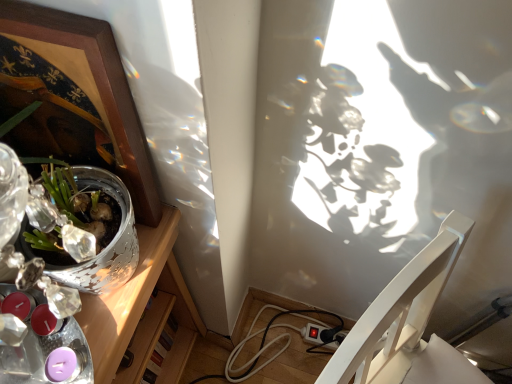
Describe the element at coordinates (137, 297) in the screenshot. Image resolution: width=512 pixels, height=384 pixels. I see `silver metallic pot at left` at that location.

In order to click on white glossy chair at lower right in this screenshot , I will do `click(408, 324)`.

Would you say wooden picture frame at upper left is a long distance from silver metallic pot at left?

wooden picture frame at upper left is actually quite close to silver metallic pot at left.

From the image's perspective, is wooden picture frame at upper left on silver metallic pot at left?

Yes, from the image's perspective, wooden picture frame at upper left is above silver metallic pot at left.

In terms of width, does wooden picture frame at upper left look wider or thinner when compared to silver metallic pot at left?

Considering their sizes, wooden picture frame at upper left looks slimmer than silver metallic pot at left.

From the image's perspective, is silver metallic pot at left located above or below wooden picture frame at upper left?

Based on their image positions, silver metallic pot at left is located beneath wooden picture frame at upper left.

From a real-world perspective, who is located lower, silver metallic pot at left or wooden picture frame at upper left?

silver metallic pot at left is physically lower.

Which is more to the left, silver metallic pot at left or wooden picture frame at upper left?

silver metallic pot at left is more to the left.

Which is in front, point (150, 258) or point (139, 125)?

The point (139, 125) is closer.

Considering the relative sizes of silver metallic pot at left and white glossy chair at lower right in the image provided, is silver metallic pot at left shorter than white glossy chair at lower right?

Correct, silver metallic pot at left is not as tall as white glossy chair at lower right.

Can you tell me how much silver metallic pot at left and white glossy chair at lower right differ in facing direction?

They differ by 25.4 degrees in their facing directions.

Is white glossy chair at lower right a part of silver metallic pot at left?

Definitely not — white glossy chair at lower right is not inside silver metallic pot at left.

I want to click on desk above the white glossy chair at lower right (from the image's perspective), so click(137, 297).

Is white glossy chair at lower right to the left of wooden picture frame at upper left from the viewer's perspective?

No, white glossy chair at lower right is not to the left of wooden picture frame at upper left.

From the image's perspective, which one is positioned lower, white glossy chair at lower right or wooden picture frame at upper left?

white glossy chair at lower right appears lower in the image.

Considering the sizes of objects white glossy chair at lower right and wooden picture frame at upper left in the image provided, who is thinner, white glossy chair at lower right or wooden picture frame at upper left?

With smaller width is wooden picture frame at upper left.

Is wooden picture frame at upper left oriented towards white glossy chair at lower right?

No, wooden picture frame at upper left does not turn towards white glossy chair at lower right.

Considering the positions of objects wooden picture frame at upper left and white glossy chair at lower right in the image provided, who is more to the right, wooden picture frame at upper left or white glossy chair at lower right?

From the viewer's perspective, white glossy chair at lower right appears more on the right side.

Does wooden picture frame at upper left touch white glossy chair at lower right?

No, wooden picture frame at upper left is not in contact with white glossy chair at lower right.

Choose the correct answer: Is wooden picture frame at upper left inside white glossy chair at lower right or outside it?

wooden picture frame at upper left is not enclosed by white glossy chair at lower right.

Locate an element on the screen. The width and height of the screenshot is (512, 384). chair below the silver metallic pot at left (from the image's perspective) is located at coordinates (408, 324).

Is point (477, 382) positioned behind point (155, 265)?

That is True.

Is white glossy chair at lower right with silver metallic pot at left?

white glossy chair at lower right and silver metallic pot at left are not in contact.

Is white glossy chair at lower right facing away from silver metallic pot at left?

white glossy chair at lower right is not turned away from silver metallic pot at left.

This screenshot has width=512, height=384. What are the coordinates of `desk that is on the left side of wooden picture frame at upper left` in the screenshot? It's located at (137, 297).

Identify the location of desk that appears below the wooden picture frame at upper left (from the image's perspective). The height and width of the screenshot is (384, 512). (137, 297).

Looking at the image, which one is located closer to silver metallic pot at left, wooden picture frame at upper left or white glossy chair at lower right?

wooden picture frame at upper left.

Based on their spatial positions, is wooden picture frame at upper left or silver metallic pot at left further from white glossy chair at lower right?

wooden picture frame at upper left.

From the image, which object appears to be farther from wooden picture frame at upper left, white glossy chair at lower right or silver metallic pot at left?

The object further to wooden picture frame at upper left is white glossy chair at lower right.

From the image, which object appears to be nearer to white glossy chair at lower right, silver metallic pot at left or wooden picture frame at upper left?

silver metallic pot at left lies closer to white glossy chair at lower right than the other object.

Considering their positions, is white glossy chair at lower right positioned further to silver metallic pot at left than wooden picture frame at upper left?

The object further to silver metallic pot at left is white glossy chair at lower right.

In the scene shown: When comparing their distances from wooden picture frame at upper left, does silver metallic pot at left or white glossy chair at lower right seem closer?

silver metallic pot at left lies closer to wooden picture frame at upper left than the other object.

You are a GUI agent. You are given a task and a screenshot of the screen. Output one action in this format:
    pyautogui.click(x=<x>, y=<y>)
    Task: Click on the picture frame between silver metallic pot at left and white glossy chair at lower right from left to right
    The width and height of the screenshot is (512, 384).
    Given the screenshot: What is the action you would take?
    pyautogui.click(x=97, y=89)